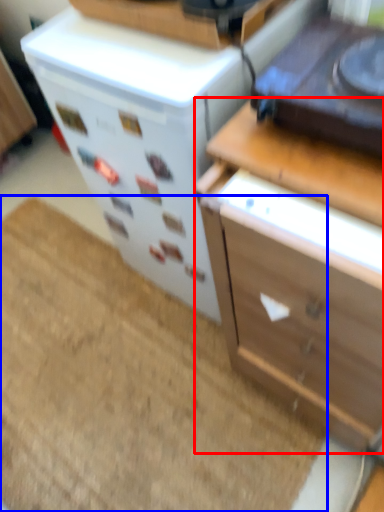
Question: Among these objects, which one is farthest to the camera, chest of drawers (highlighted by a red box) or doormat (highlighted by a blue box)?

Choices:
 (A) chest of drawers
 (B) doormat

Answer: (B)